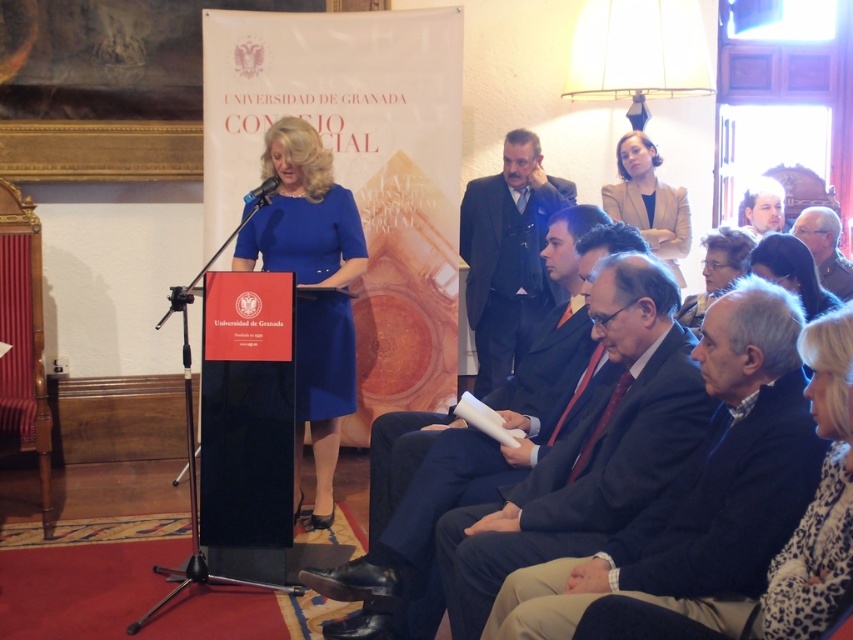
Question: Is dark suit at center to the left of dark brown fur coat at lower right from the viewer's perspective?

Choices:
 (A) no
 (B) yes

Answer: (B)

Question: Which point is closer to the camera?

Choices:
 (A) (827, 208)
 (B) (448, 499)
 (C) (807, 310)
 (D) (695, 326)

Answer: (B)

Question: Which of these objects is positioned farthest from the dark gray suit at lower right?

Choices:
 (A) gray fabric jacket at upper right
 (B) dark brown fur coat at lower right
 (C) dark gray suit at center
 (D) light beige blazer at upper right

Answer: (D)

Question: Is dark suit at center wider than blue fabric dress at center?

Choices:
 (A) no
 (B) yes

Answer: (B)

Question: Which point is closer to the camera?

Choices:
 (A) dark gray suit at center
 (B) matte black hair at upper center

Answer: (B)

Question: Can you confirm if dark gray suit at lower right is positioned below light brown hair at upper right?

Choices:
 (A) no
 (B) yes

Answer: (B)